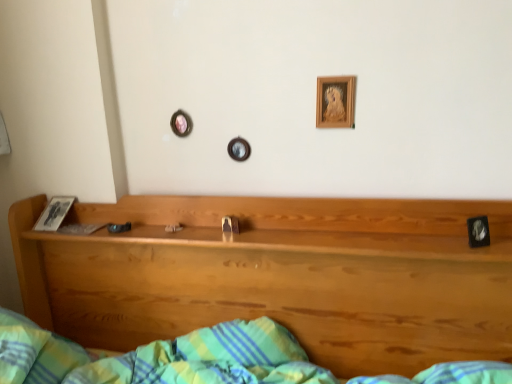
Question: Does black glossy picture frame at right, positioned as the first picture frame in front-to-back order, turn towards wooden headboard at center?

Choices:
 (A) yes
 (B) no

Answer: (A)

Question: Does black glossy picture frame at right, marked as the first picture frame in a bottom-to-top arrangement, have a lesser height compared to wooden headboard at center?

Choices:
 (A) no
 (B) yes

Answer: (B)

Question: Is black glossy picture frame at right, which is the 2th picture frame from top to bottom, positioned before wooden headboard at center?

Choices:
 (A) no
 (B) yes

Answer: (A)

Question: Can you confirm if black glossy picture frame at right, the first picture frame from the right, is wider than wooden headboard at center?

Choices:
 (A) yes
 (B) no

Answer: (B)

Question: From a real-world perspective, is black glossy picture frame at right, marked as the first picture frame in a bottom-to-top arrangement, positioned over wooden headboard at center based on gravity?

Choices:
 (A) no
 (B) yes

Answer: (B)

Question: Can you confirm if black glossy picture frame at right, which is counted as the 2th picture frame, starting from the left, is bigger than wooden headboard at center?

Choices:
 (A) no
 (B) yes

Answer: (A)

Question: Considering the relative positions of wooden picture frame at upper center, the 1th picture frame positioned from the back, and black glossy picture frame at right, which is the 2th picture frame from top to bottom, in the image provided, is wooden picture frame at upper center, the 1th picture frame positioned from the back, to the left of black glossy picture frame at right, which is the 2th picture frame from top to bottom, from the viewer's perspective?

Choices:
 (A) no
 (B) yes

Answer: (B)

Question: Is wooden picture frame at upper center, which ranks as the 1th picture frame in top-to-bottom order, wider than black glossy picture frame at right, which is the 2th picture frame from top to bottom?

Choices:
 (A) no
 (B) yes

Answer: (A)

Question: Is wooden picture frame at upper center, the 1th picture frame positioned from the back, far from black glossy picture frame at right, positioned as the first picture frame in front-to-back order?

Choices:
 (A) yes
 (B) no

Answer: (B)

Question: From a real-world perspective, is wooden picture frame at upper center, arranged as the second picture frame when viewed from the right, located beneath black glossy picture frame at right, marked as the first picture frame in a bottom-to-top arrangement?

Choices:
 (A) no
 (B) yes

Answer: (A)

Question: From the image's perspective, is wooden picture frame at upper center, the 1th picture frame when ordered from left to right, on top of black glossy picture frame at right, acting as the 2th picture frame starting from the back?

Choices:
 (A) yes
 (B) no

Answer: (A)

Question: Is wooden picture frame at upper center, which ranks as the 1th picture frame in top-to-bottom order, closer to camera compared to black glossy picture frame at right, which is the 2th picture frame from top to bottom?

Choices:
 (A) no
 (B) yes

Answer: (A)

Question: Is wooden headboard at center smaller than wooden picture frame at upper center, which appears as the second picture frame when ordered from the bottom?

Choices:
 (A) no
 (B) yes

Answer: (A)